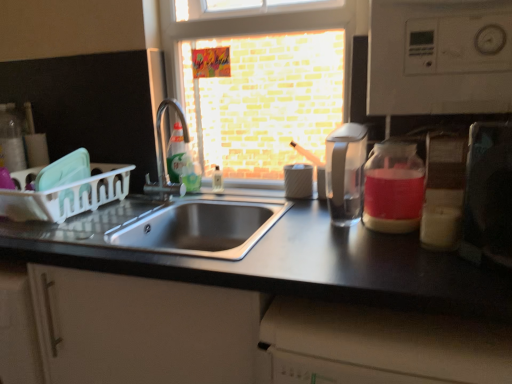
Question: Is satin nickel faucet at sink left taller than white plastic dish rack at left?

Choices:
 (A) no
 (B) yes

Answer: (B)

Question: Would you say satin nickel faucet at sink left contains white plastic dish rack at left?

Choices:
 (A) yes
 (B) no

Answer: (B)

Question: Does satin nickel faucet at sink left have a lesser width compared to white plastic dish rack at left?

Choices:
 (A) yes
 (B) no

Answer: (A)

Question: Does satin nickel faucet at sink left turn towards white plastic dish rack at left?

Choices:
 (A) yes
 (B) no

Answer: (A)

Question: From a real-world perspective, is satin nickel faucet at sink left located higher than white plastic dish rack at left?

Choices:
 (A) yes
 (B) no

Answer: (A)

Question: Is satin nickel faucet at sink left directly adjacent to white plastic dish rack at left?

Choices:
 (A) yes
 (B) no

Answer: (B)

Question: Is metallic silver toaster at right looking in the opposite direction of metallic stainless steel sink at center?

Choices:
 (A) yes
 (B) no

Answer: (B)

Question: Considering the relative sizes of metallic silver toaster at right and metallic stainless steel sink at center in the image provided, is metallic silver toaster at right wider than metallic stainless steel sink at center?

Choices:
 (A) no
 (B) yes

Answer: (A)

Question: Can you confirm if metallic silver toaster at right is taller than metallic stainless steel sink at center?

Choices:
 (A) yes
 (B) no

Answer: (B)

Question: Does metallic silver toaster at right appear on the left side of metallic stainless steel sink at center?

Choices:
 (A) no
 (B) yes

Answer: (A)

Question: Is metallic silver toaster at right behind metallic stainless steel sink at center?

Choices:
 (A) no
 (B) yes

Answer: (A)

Question: From a real-world perspective, is metallic silver toaster at right positioned under metallic stainless steel sink at center based on gravity?

Choices:
 (A) yes
 (B) no

Answer: (B)

Question: Can you confirm if white plastic dish rack at left is positioned to the right of pink translucent glass jar at right?

Choices:
 (A) yes
 (B) no

Answer: (B)